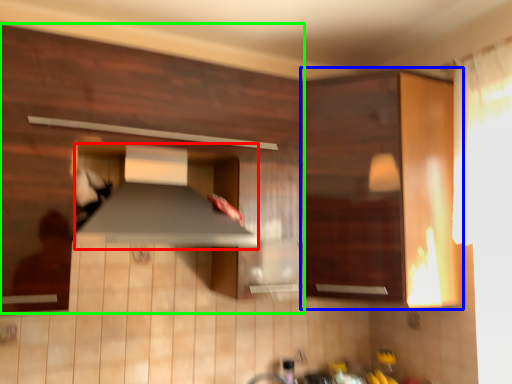
Question: Which is nearer to the exhaust hood (highlighted by a red box)? cabinetry (highlighted by a blue box) or cabinetry (highlighted by a green box).

Choices:
 (A) cabinetry
 (B) cabinetry

Answer: (B)